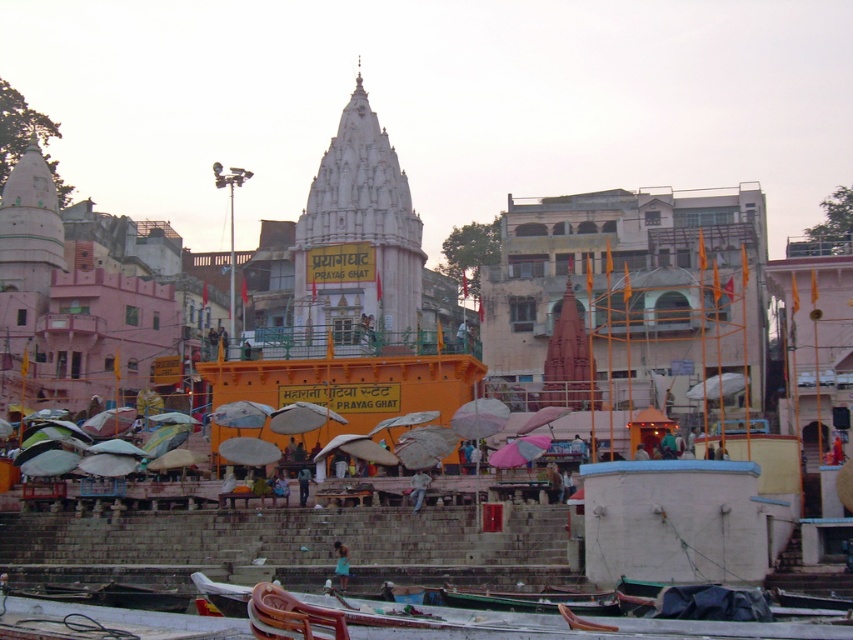
You are a tourist visiting the Prayag Ghat temple. You want to take a photo of the white marble temple at center and the wooden boat at lower center together in the frame. Given that your camera can only capture objects within a 100m distance, will both objects fit in the frame if the temple is 80 meters away from you?

The white marble temple at center is bigger than the wooden boat at lower center, but the question is about distance. Since the temple is 80 meters away and the boat is closer or farther isn

You are standing at the riverside in Prayag Ghat and want to locate the white marble temple at center. According to the coordinates provided, where exactly would you find it?

The white marble temple at center is located at coordinates point (358, 234).

You are a tourist visiting the Prayag Ghat temple and want to take a photo of the wooden boat at lower center and the light blue jeans at center. Since you want both to be in the frame, will the boat fit in the photo if the jeans are already occupying the center?

The wooden boat at lower center is wider than the light blue jeans at center, so it might not fit entirely in the photo if the jeans are already centered. Adjust your angle or zoom to include both.